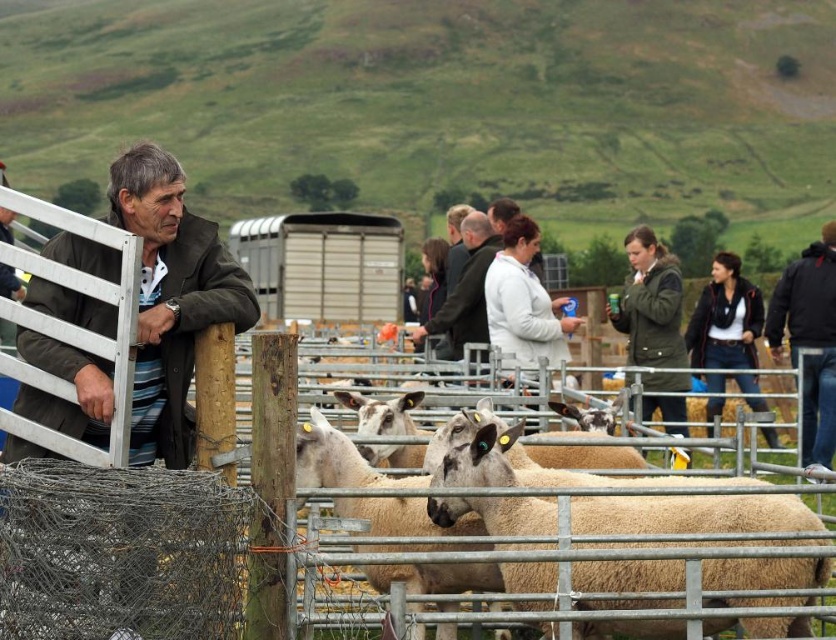
Which is in front, point (381, 481) or point (766, 312)?

Point (381, 481)

Can you confirm if fuzzy woolen sheep at center is shorter than dark green jacket at right?

Yes, fuzzy woolen sheep at center is shorter than dark green jacket at right.

What are the coordinates of `fuzzy woolen sheep at center` in the screenshot? It's located at (339, 460).

I want to click on fuzzy woolen sheep at center, so click(339, 460).

Does metallic silver fence at center have a smaller size compared to white coat at center?

No, metallic silver fence at center is not smaller than white coat at center.

Which is behind, point (339, 394) or point (498, 237)?

Positioned behind is point (498, 237).

The width and height of the screenshot is (836, 640). In order to click on metallic silver fence at center in this screenshot , I will do `click(213, 394)`.

Consider the image. Which is more to the left, white woolen sheep at center or white coat at center?

Positioned to the left is white coat at center.

What do you see at coordinates (691, 515) in the screenshot?
I see `white woolen sheep at center` at bounding box center [691, 515].

Locate an element on the screen. This screenshot has height=640, width=836. white woolen sheep at center is located at coordinates (691, 515).